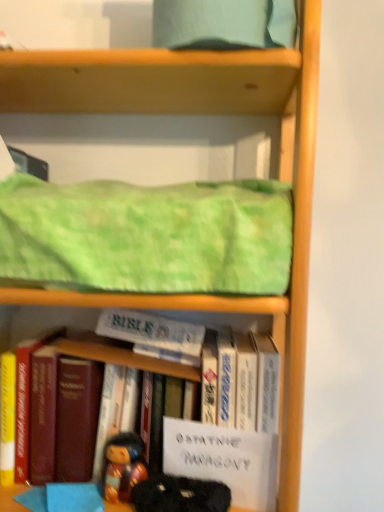
Question: Is wooden figurine at lower center taller than green textured fabric at upper center?

Choices:
 (A) yes
 (B) no

Answer: (B)

Question: Is wooden figurine at lower center oriented towards green textured fabric at upper center?

Choices:
 (A) no
 (B) yes

Answer: (A)

Question: Does wooden figurine at lower center have a smaller size compared to green textured fabric at upper center?

Choices:
 (A) no
 (B) yes

Answer: (B)

Question: Is green textured fabric at upper center located within wooden figurine at lower center?

Choices:
 (A) no
 (B) yes

Answer: (A)

Question: Does wooden figurine at lower center appear on the left side of green textured fabric at upper center?

Choices:
 (A) no
 (B) yes

Answer: (B)

Question: Is wooden figurine at lower center not inside green textured fabric at upper center?

Choices:
 (A) yes
 (B) no

Answer: (A)

Question: Considering the relative positions of velvet-like black doll at lower center and wooden figurine at lower center in the image provided, is velvet-like black doll at lower center in front of wooden figurine at lower center?

Choices:
 (A) yes
 (B) no

Answer: (A)

Question: From a real-world perspective, is velvet-like black doll at lower center below wooden figurine at lower center?

Choices:
 (A) yes
 (B) no

Answer: (A)

Question: From a real-world perspective, is velvet-like black doll at lower center physically above wooden figurine at lower center?

Choices:
 (A) yes
 (B) no

Answer: (B)

Question: Could wooden figurine at lower center be considered to be inside velvet-like black doll at lower center?

Choices:
 (A) yes
 (B) no

Answer: (B)

Question: From the image's perspective, does velvet-like black doll at lower center appear higher than wooden figurine at lower center?

Choices:
 (A) no
 (B) yes

Answer: (A)

Question: Is velvet-like black doll at lower center with wooden figurine at lower center?

Choices:
 (A) yes
 (B) no

Answer: (A)

Question: Does hardcover book at center, which ranks as the 2th book in right-to-left order, have a greater width compared to white paper at center, the 2th paperback book positioned from the top?

Choices:
 (A) no
 (B) yes

Answer: (B)